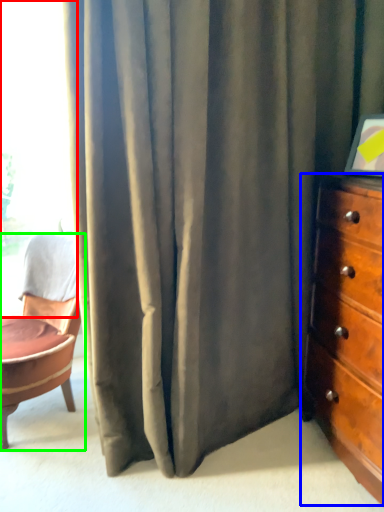
Question: Which object is positioned closest to window (highlighted by a red box)? Select from chest of drawers (highlighted by a blue box) and chair (highlighted by a green box).

Choices:
 (A) chest of drawers
 (B) chair

Answer: (B)